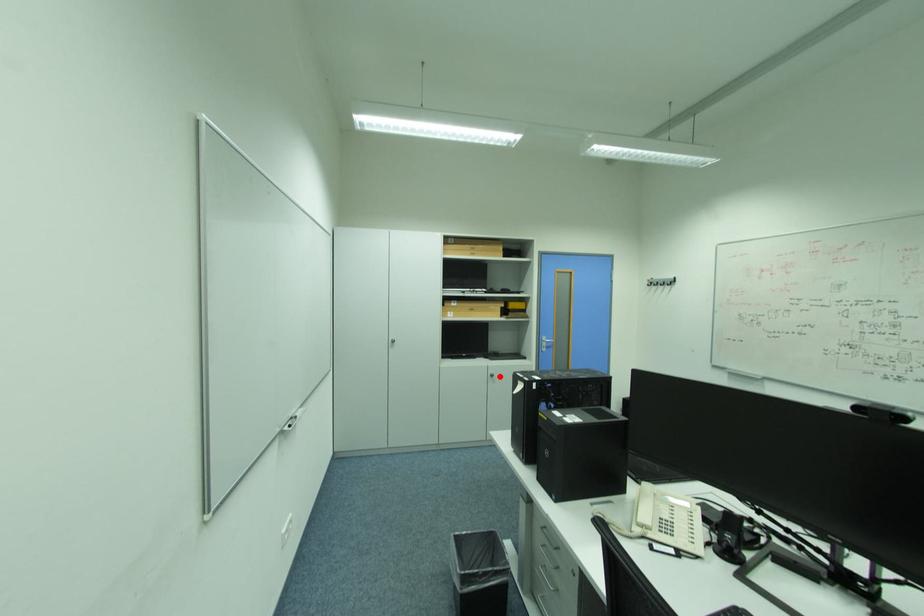
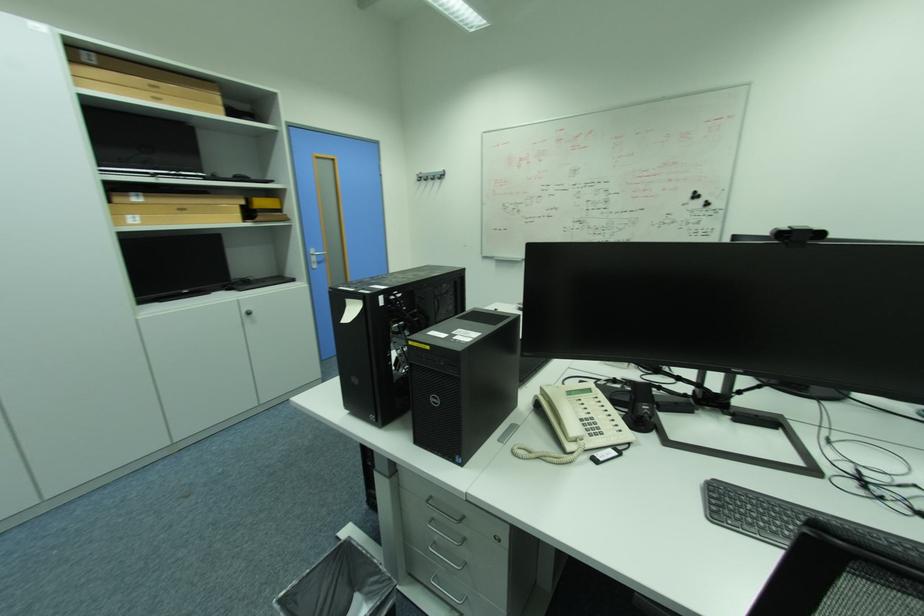
Question: I am providing you with two images of the same scene from different viewpoints. Image1 has a red point marked. In image2, the corresponding 3D location appears at what relative position? Reply with the corresponding letter.

Choices:
 (A) Closer
 (B) Farther

Answer: (A)